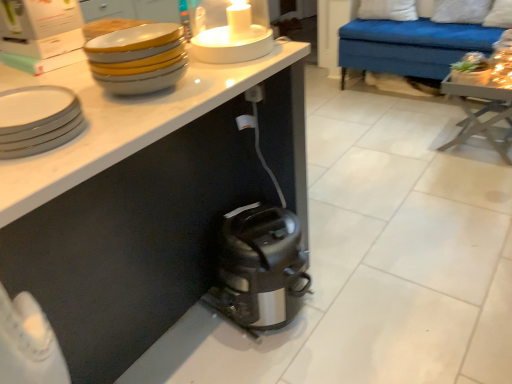
Measure the distance between point (108, 87) and camera.

Point (108, 87) is 38.15 inches from camera.

What are the coordinates of `white soft pillow at upper right, which is counted as the 1th pillow, starting from the left` in the screenshot? It's located at (388, 10).

You are a GUI agent. You are given a task and a screenshot of the screen. Output one action in this format:
    pyautogui.click(x=<x>, y=<y>)
    Task: Click on the satin black toaster at lower center
    
    Given the screenshot: What is the action you would take?
    pyautogui.click(x=144, y=201)

What is the approximate width of wooden table at right?

wooden table at right is 16.44 inches wide.

The image size is (512, 384). What do you see at coordinates (461, 11) in the screenshot? I see `white soft pillow at upper right, placed as the 1th pillow when sorted from right to left` at bounding box center [461, 11].

Image resolution: width=512 pixels, height=384 pixels. Find the location of `matte white bowl at lower right`. matte white bowl at lower right is located at coordinates (470, 77).

Can you confirm if white glossy plate at upper left, positioned as the 1th tableware in bottom-to-top order, is positioned to the left of white glossy bowls at upper left, which is the second tableware in bottom-to-top order?

Indeed, white glossy plate at upper left, positioned as the 1th tableware in bottom-to-top order, is positioned on the left side of white glossy bowls at upper left, which is the second tableware in bottom-to-top order.

How many degrees apart are the facing directions of white glossy plate at upper left, positioned as the 1th tableware in bottom-to-top order, and white glossy bowls at upper left, which is the second tableware in bottom-to-top order?

white glossy plate at upper left, positioned as the 1th tableware in bottom-to-top order, and white glossy bowls at upper left, which is the second tableware in bottom-to-top order, are facing 176 degrees away from each other.

Identify the location of tableware on the left side of white glossy bowls at upper left, which is the second tableware in bottom-to-top order. (38, 120).

Consider the image. Is white glossy plate at upper left, positioned as the 1th tableware in bottom-to-top order, completely or partially outside of white glossy bowls at upper left, which is the second tableware in bottom-to-top order?

Yes, white glossy plate at upper left, positioned as the 1th tableware in bottom-to-top order, is outside of white glossy bowls at upper left, which is the second tableware in bottom-to-top order.

Based on their sizes in the image, would you say white glossy plate at upper left, positioned as the 1th tableware in bottom-to-top order, is bigger or smaller than satin silver toaster at lower center?

white glossy plate at upper left, positioned as the 1th tableware in bottom-to-top order, is smaller than satin silver toaster at lower center.

Based on the photo, from a real-world perspective, is white glossy plate at upper left, positioned as the 1th tableware in bottom-to-top order, positioned above or below satin silver toaster at lower center?

Clearly, from a real-world perspective, white glossy plate at upper left, positioned as the 1th tableware in bottom-to-top order, is above satin silver toaster at lower center.

From the image's perspective, is white glossy plate at upper left, the 2th tableware when ordered from top to bottom, positioned above or below satin silver toaster at lower center?

Clearly, from the image's perspective, white glossy plate at upper left, the 2th tableware when ordered from top to bottom, is above satin silver toaster at lower center.

Which of these two, white glossy plate at upper left, the 2th tableware when ordered from top to bottom, or satin silver toaster at lower center, stands taller?

Standing taller between the two is satin silver toaster at lower center.

Does point (251, 30) come farther from viewer compared to point (376, 1)?

No.

From the picture: Which is more to the right, white glossy candle holder at upper center or white soft pillow at upper right, which is counted as the 1th pillow, starting from the left?

From the viewer's perspective, white soft pillow at upper right, which is counted as the 1th pillow, starting from the left, appears more on the right side.

At what (x,y) coordinates should I click in order to perform the action: click on candle holder on the left of white soft pillow at upper right, marked as the second pillow in a right-to-left arrangement. Please return your answer as a coordinate pair (x, y). The image size is (512, 384). Looking at the image, I should click on (230, 30).

Which object is closer to the camera taking this photo, white glossy plate at upper left, positioned as the 1th tableware in bottom-to-top order, or white soft pillow at upper right, marked as the second pillow in a right-to-left arrangement?

white glossy plate at upper left, positioned as the 1th tableware in bottom-to-top order, is in front.

Which is closer to the camera, (29, 120) or (359, 17)?

Point (29, 120) is positioned closer to the camera compared to point (359, 17).

Is white glossy plate at upper left, positioned as the 1th tableware in bottom-to-top order, oriented towards white soft pillow at upper right, which is counted as the 1th pillow, starting from the left?

No, white glossy plate at upper left, positioned as the 1th tableware in bottom-to-top order, is not turned towards white soft pillow at upper right, which is counted as the 1th pillow, starting from the left.

Between satin black toaster at lower center and white glossy plate at upper left, the 2th tableware when ordered from top to bottom, which one is positioned in front?

white glossy plate at upper left, the 2th tableware when ordered from top to bottom, is more forward.

Between satin black toaster at lower center and white glossy plate at upper left, positioned as the 1th tableware in bottom-to-top order, which one appears on the left side from the viewer's perspective?

A: Positioned to the left is white glossy plate at upper left, positioned as the 1th tableware in bottom-to-top order.

Is satin black toaster at lower center spatially inside white glossy plate at upper left, the 2th tableware when ordered from top to bottom, or outside of it?

satin black toaster at lower center is not inside white glossy plate at upper left, the 2th tableware when ordered from top to bottom, it's outside.

What's the angular difference between satin black toaster at lower center and white glossy plate at upper left, the 2th tableware when ordered from top to bottom,'s facing directions?

180 degrees separate the facing orientations of satin black toaster at lower center and white glossy plate at upper left, the 2th tableware when ordered from top to bottom.

Between white glossy bowls at upper left, which is the second tableware in bottom-to-top order, and white glossy candle holder at upper center, which one appears on the left side from the viewer's perspective?

From the viewer's perspective, white glossy bowls at upper left, which is the second tableware in bottom-to-top order, appears more on the left side.

Is white glossy bowls at upper left, which is the 1th tableware from top to bottom, shorter than white glossy candle holder at upper center?

Yes, white glossy bowls at upper left, which is the 1th tableware from top to bottom, is shorter than white glossy candle holder at upper center.

Based on the photo, is the position of white glossy bowls at upper left, which is the second tableware in bottom-to-top order, less distant than that of white glossy candle holder at upper center?

Yes, white glossy bowls at upper left, which is the second tableware in bottom-to-top order, is in front of white glossy candle holder at upper center.

Considering the relative sizes of white glossy bowls at upper left, which is the second tableware in bottom-to-top order, and white glossy candle holder at upper center in the image provided, is white glossy bowls at upper left, which is the second tableware in bottom-to-top order, smaller than white glossy candle holder at upper center?

Yes, white glossy bowls at upper left, which is the second tableware in bottom-to-top order, is smaller than white glossy candle holder at upper center.

Between white soft pillow at upper right, marked as the second pillow in a right-to-left arrangement, and white soft pillow at upper right, placed as the 1th pillow when sorted from right to left, which one has less height?

white soft pillow at upper right, marked as the second pillow in a right-to-left arrangement.

Can you see white soft pillow at upper right, marked as the second pillow in a right-to-left arrangement, touching white soft pillow at upper right, which is the second pillow in left-to-right order?

No, white soft pillow at upper right, marked as the second pillow in a right-to-left arrangement, is not beside white soft pillow at upper right, which is the second pillow in left-to-right order.

Does white soft pillow at upper right, which is counted as the 1th pillow, starting from the left, turn towards white soft pillow at upper right, placed as the 1th pillow when sorted from right to left?

No, white soft pillow at upper right, which is counted as the 1th pillow, starting from the left, is not turned towards white soft pillow at upper right, placed as the 1th pillow when sorted from right to left.

I want to click on tableware located on the right of white glossy plate at upper left, positioned as the 1th tableware in bottom-to-top order, so click(x=138, y=58).

At what (x,y) coordinates should I click in order to perform the action: click on home appliance that is under the white glossy plate at upper left, positioned as the 1th tableware in bottom-to-top order (from a real-world perspective). Please return your answer as a coordinate pair (x, y). Looking at the image, I should click on (259, 269).

Based on their spatial positions, is white glossy candle holder at upper center or matte white bowl at lower right further from satin black toaster at lower center?

matte white bowl at lower right lies further to satin black toaster at lower center than the other object.

When comparing their distances from satin silver toaster at lower center, does white glossy bowls at upper left, which is the second tableware in bottom-to-top order, or matte white bowl at lower right seem closer?

white glossy bowls at upper left, which is the second tableware in bottom-to-top order, lies closer to satin silver toaster at lower center than the other object.

Based on their spatial positions, is white soft pillow at upper right, marked as the second pillow in a right-to-left arrangement, or satin silver toaster at lower center closer to white glossy plate at upper left, positioned as the 1th tableware in bottom-to-top order?

satin silver toaster at lower center.

When comparing their distances from white glossy candle holder at upper center, does matte white bowl at lower right or satin silver toaster at lower center seem closer?

satin silver toaster at lower center lies closer to white glossy candle holder at upper center than the other object.

Based on their spatial positions, is satin silver toaster at lower center or matte white bowl at lower right closer to white soft pillow at upper right, marked as the second pillow in a right-to-left arrangement?

matte white bowl at lower right lies closer to white soft pillow at upper right, marked as the second pillow in a right-to-left arrangement, than the other object.

Looking at the image, which one is located further to wooden table at right, white glossy candle holder at upper center or white glossy plate at upper left, the 2th tableware when ordered from top to bottom?

Based on the image, white glossy plate at upper left, the 2th tableware when ordered from top to bottom, appears to be further to wooden table at right.

Based on their spatial positions, is white glossy candle holder at upper center or matte white bowl at lower right closer to white soft pillow at upper right, which is counted as the 1th pillow, starting from the left?

matte white bowl at lower right lies closer to white soft pillow at upper right, which is counted as the 1th pillow, starting from the left, than the other object.

From the image, which object appears to be farther from white glossy candle holder at upper center, white soft pillow at upper right, which is counted as the 1th pillow, starting from the left, or satin silver toaster at lower center?

The object further to white glossy candle holder at upper center is white soft pillow at upper right, which is counted as the 1th pillow, starting from the left.

The height and width of the screenshot is (384, 512). Identify the location of candle holder between white glossy plate at upper left, the 2th tableware when ordered from top to bottom, and matte white bowl at lower right from left to right. (230, 30).

Where is `candle holder between white glossy bowls at upper left, which is the 1th tableware from top to bottom, and white soft pillow at upper right, which is the second pillow in left-to-right order, from front to back`? This screenshot has width=512, height=384. candle holder between white glossy bowls at upper left, which is the 1th tableware from top to bottom, and white soft pillow at upper right, which is the second pillow in left-to-right order, from front to back is located at coordinates (230, 30).

Identify the location of bowl between white glossy plate at upper left, positioned as the 1th tableware in bottom-to-top order, and white soft pillow at upper right, which is counted as the 1th pillow, starting from the left, from front to back. (470, 77).

The image size is (512, 384). Identify the location of candle holder between satin black toaster at lower center and matte white bowl at lower right along the z-axis. (230, 30).